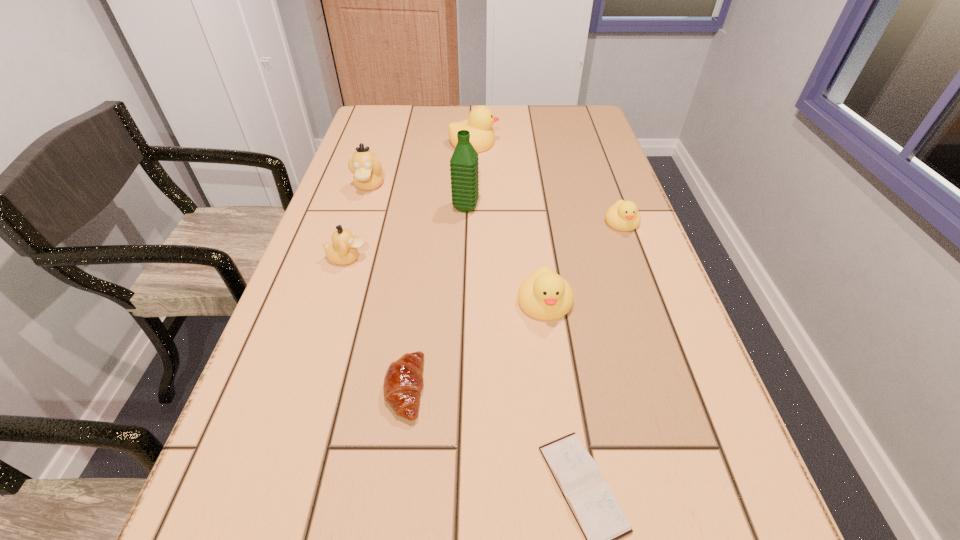
The image size is (960, 540). I want to click on free spot that satisfies the following two spatial constraints: 1. on the face of the seventh tallest object; 2. on the left side of the fourth nearest object, so click(x=306, y=389).

This screenshot has height=540, width=960. What are the coordinates of `vacant space that satisfies the following two spatial constraints: 1. on the face of the second shortest object; 2. on the left side of the bigger tan duckling` in the screenshot? It's located at pos(305,389).